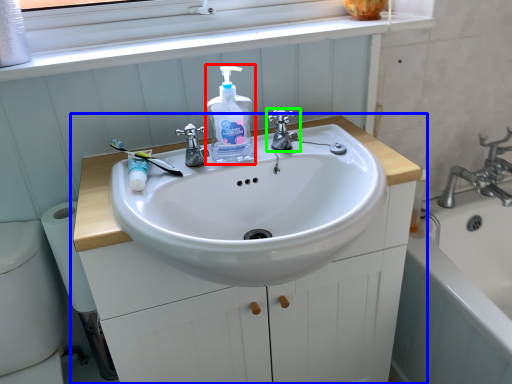
Question: Based on their relative distances, which object is farther from cleaning product (highlighted by a red box)? Choose from bathroom cabinet (highlighted by a blue box) and tap (highlighted by a green box).

Choices:
 (A) bathroom cabinet
 (B) tap

Answer: (A)